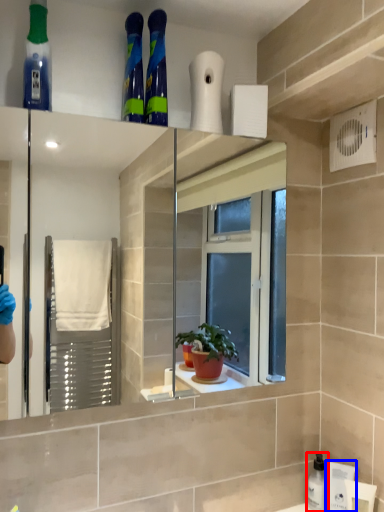
Question: Which object appears farthest to the camera in this image, cleaning product (highlighted by a red box) or toiletry (highlighted by a blue box)?

Choices:
 (A) cleaning product
 (B) toiletry

Answer: (A)